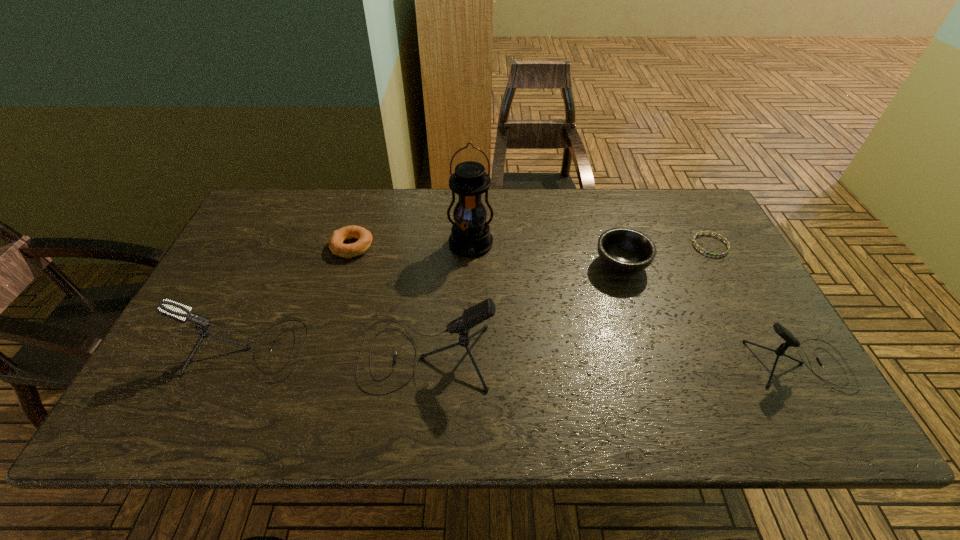
Where is `the third tallest object`? Image resolution: width=960 pixels, height=540 pixels. the third tallest object is located at coordinates (172, 309).

Identify the location of the second shortest microphone. (172, 309).

Find the location of `the second microphone from left to right`. the second microphone from left to right is located at coordinates (480, 312).

Find the location of `the shortest microphone`. the shortest microphone is located at coordinates (791, 341).

Find the location of a particular element. the rightmost microphone is located at coordinates (791, 341).

Where is `lantern`? The height and width of the screenshot is (540, 960). lantern is located at coordinates (470, 236).

What are the coordinates of `the second shortest object` in the screenshot? It's located at (364, 237).

Locate an element on the screen. This screenshot has height=540, width=960. the fifth object from left to right is located at coordinates coord(623,250).

At what (x,y) coordinates should I click in order to perform the action: click on the fifth tallest object. Please return your answer as a coordinate pair (x, y). Looking at the image, I should click on (623, 250).

Locate an element on the screen. bracelet is located at coordinates (707, 253).